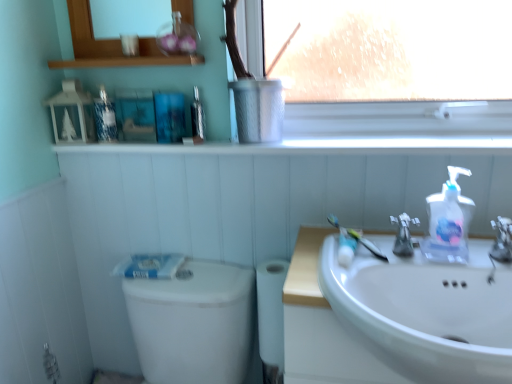
Question: Is translucent plastic toothbrush at sink inside the boundaries of white glossy window sill at upper center, which is the second window sill from top to bottom, or outside?

Choices:
 (A) outside
 (B) inside

Answer: (A)

Question: From the image's perspective, is translucent plastic toothbrush at sink above or below white glossy window sill at upper center, which is the second window sill from top to bottom?

Choices:
 (A) above
 (B) below

Answer: (B)

Question: Considering the real-world distances, which object is closest to the satin nickel faucet at sink right, arranged as the 1th tap when viewed from the left?

Choices:
 (A) white glossy window sill at upper center, which is the second window sill from top to bottom
 (B) satin nickel faucet at sink right, which ranks as the 2th tap in left-to-right order
 (C) metallic silver mouthwash at upper center, positioned as the first mouthwash in right-to-left order
 (D) translucent plastic toothbrush at sink
 (E) clear plastic soap dispenser at right

Answer: (E)

Question: Which is farther from the white glossy toilet bowl at lower left?

Choices:
 (A) white glossy sink at lower right
 (B) clear plastic soap dispenser at right
 (C) metallic silver window sill at upper center, the 1th window sill positioned from the top
 (D) clear glass medicine cabinet at upper center
 (E) metallic silver mouthwash at upper center, positioned as the first mouthwash in right-to-left order

Answer: (C)